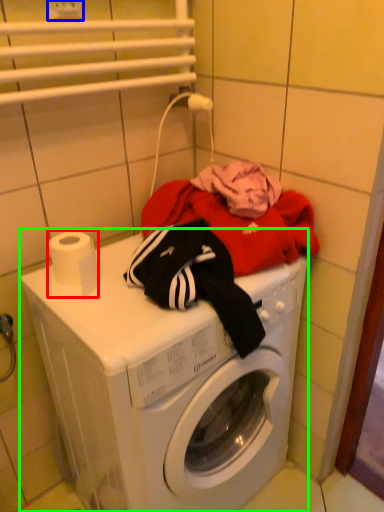
Question: Which object is positioned closest to toilet paper (highlighted by a red box)? Select from electric outlet (highlighted by a blue box) and washing machine (highlighted by a green box).

Choices:
 (A) electric outlet
 (B) washing machine

Answer: (B)